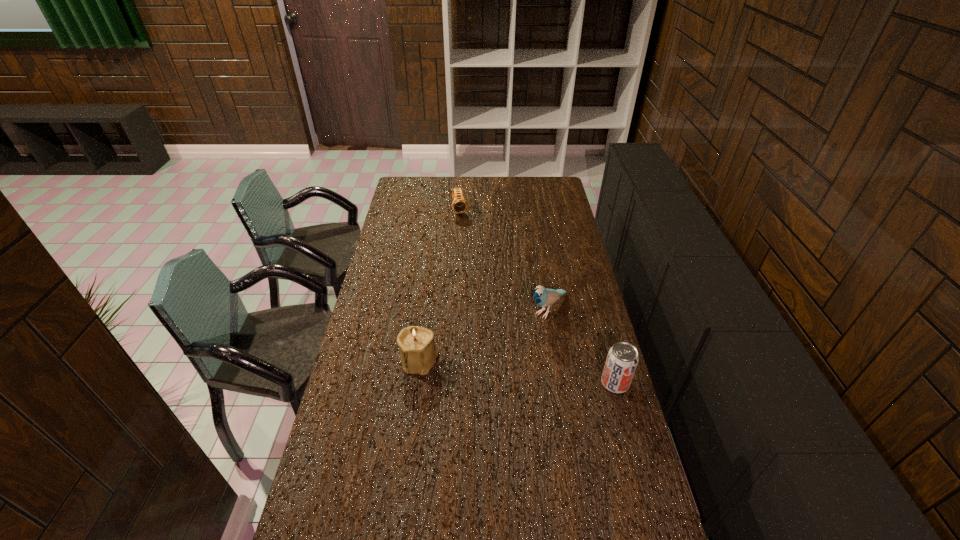
At what (x,y) coordinates should I click in order to perform the action: click on vacant space on the desktop that is between the candle_holder and the rightmost object and is positioned on the face of the shortest object. Please return your answer as a coordinate pair (x, y). This screenshot has width=960, height=540. Looking at the image, I should click on (506, 370).

This screenshot has width=960, height=540. In order to click on vacant space on the desktop that is between the leftmost object and the rightmost object and is positioned at the face of the third object from left to right in this screenshot , I will do (487, 368).